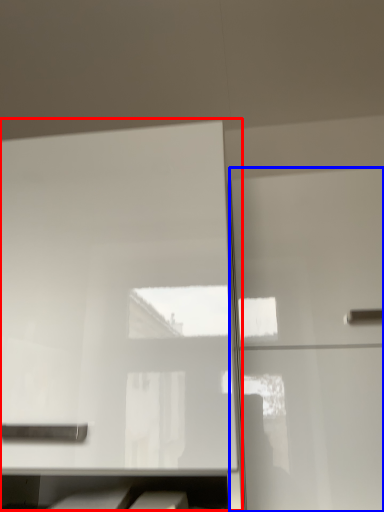
Question: Which object appears closest to the camera in this image, cabinetry (highlighted by a red box) or cabinetry (highlighted by a blue box)?

Choices:
 (A) cabinetry
 (B) cabinetry

Answer: (A)